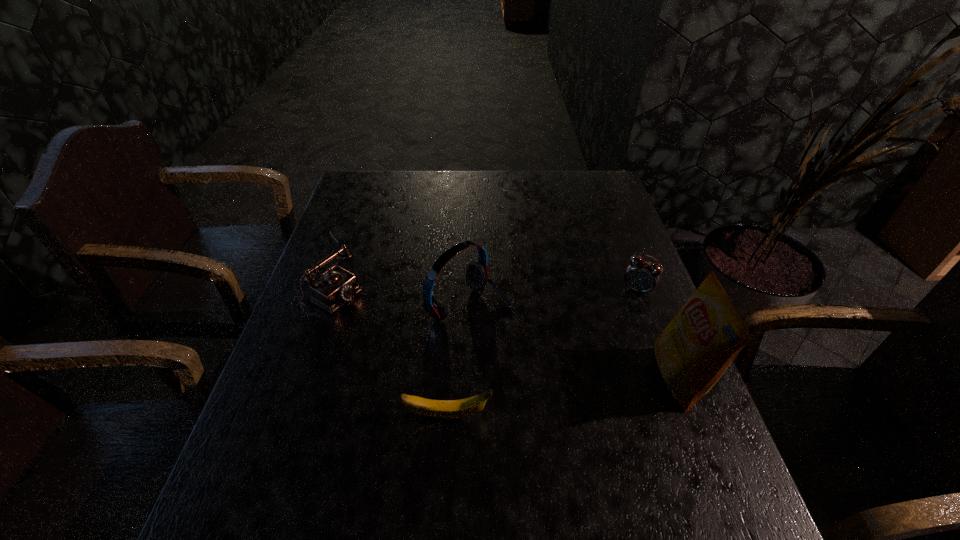
Locate an element on the screen. The height and width of the screenshot is (540, 960). vacant spot on the desktop that is between the shortest object and the tallest object and is positioned with the microphone attached to the side of the second tallest object is located at coordinates (601, 390).

Where is `free space on the desktop that is between the shortest object and the crisp (potato chip) and is positioned on the face of the alarm clock`? free space on the desktop that is between the shortest object and the crisp (potato chip) and is positioned on the face of the alarm clock is located at coordinates (577, 394).

Where is `free spot on the desktop that is between the banana and the crisp (potato chip) and is positioned on the dial of the telephone`? The height and width of the screenshot is (540, 960). free spot on the desktop that is between the banana and the crisp (potato chip) and is positioned on the dial of the telephone is located at coordinates (560, 397).